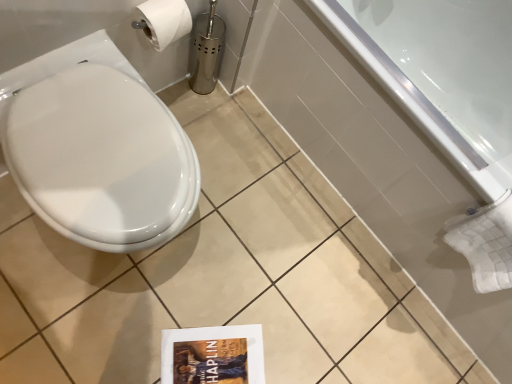
Describe the element at coordinates (375, 164) in the screenshot. I see `white glossy bathtub at upper right` at that location.

What is the approximate width of white glossy bathtub at upper right?

It is 27.56 inches.

The width and height of the screenshot is (512, 384). In order to click on white glossy bathtub at upper right in this screenshot , I will do `click(375, 164)`.

Where is `white glossy toilet at left`? The image size is (512, 384). white glossy toilet at left is located at coordinates (101, 159).

The height and width of the screenshot is (384, 512). Describe the element at coordinates (101, 159) in the screenshot. I see `white glossy toilet at left` at that location.

I want to click on white glossy bathtub at upper right, so click(x=375, y=164).

Which object is positioned more to the left, white glossy bathtub at upper right or white glossy toilet at left?

white glossy toilet at left.

Which is behind, white glossy bathtub at upper right or white glossy toilet at left?

white glossy bathtub at upper right is further away from the camera.

Considering the points (450, 174) and (150, 243), which point is behind, point (450, 174) or point (150, 243)?

The point (450, 174) is behind.

From the image's perspective, is white glossy bathtub at upper right above or below white glossy toilet at left?

Based on their image positions, white glossy bathtub at upper right is located above white glossy toilet at left.

From the picture: From a real-world perspective, between white glossy bathtub at upper right and white glossy toilet at left, who is vertically lower?

From a 3D spatial view, white glossy bathtub at upper right is below.

Between white glossy bathtub at upper right and white glossy toilet at left, which one has smaller width?

Thinner between the two is white glossy toilet at left.

Considering the relative sizes of white glossy bathtub at upper right and white glossy toilet at left in the image provided, is white glossy bathtub at upper right taller than white glossy toilet at left?

Correct, white glossy bathtub at upper right is much taller as white glossy toilet at left.

Who is smaller, white glossy bathtub at upper right or white glossy toilet at left?

white glossy toilet at left.

Choose the correct answer: Is white glossy bathtub at upper right inside white glossy toilet at left or outside it?

white glossy bathtub at upper right is located beyond the bounds of white glossy toilet at left.

Is white glossy bathtub at upper right touching white glossy toilet at left?

No, white glossy bathtub at upper right is not in contact with white glossy toilet at left.

Is white glossy bathtub at upper right oriented towards white glossy toilet at left?

Yes, white glossy bathtub at upper right is aimed at white glossy toilet at left.

What's the angular difference between white glossy bathtub at upper right and white glossy toilet at left's facing directions?

89.5 degrees.

You are a GUI agent. You are given a task and a screenshot of the screen. Output one action in this format:
    pyautogui.click(x=<x>, y=<y>)
    Task: Click on the toilet below the white glossy bathtub at upper right (from the image's perspective)
    Image resolution: width=512 pixels, height=384 pixels.
    Given the screenshot: What is the action you would take?
    pyautogui.click(x=101, y=159)

Is white glossy toilet at left at the left side of white glossy bathtub at upper right?

Yes, white glossy toilet at left is to the left of white glossy bathtub at upper right.

Considering the positions of objects white glossy toilet at left and white glossy bathtub at upper right in the image provided, who is behind, white glossy toilet at left or white glossy bathtub at upper right?

white glossy bathtub at upper right is further away from the camera.

Which is nearer, (148,113) or (431,238)?

Point (148,113) appears to be closer to the viewer than point (431,238).

From the image's perspective, is white glossy toilet at left beneath white glossy bathtub at upper right?

Yes.

From a real-world perspective, who is located lower, white glossy toilet at left or white glossy bathtub at upper right?

From a 3D spatial view, white glossy bathtub at upper right is below.

Can you confirm if white glossy toilet at left is wider than white glossy bathtub at upper right?

No, white glossy toilet at left is not wider than white glossy bathtub at upper right.

Between white glossy toilet at left and white glossy bathtub at upper right, which one has less height?

Standing shorter between the two is white glossy toilet at left.

Between white glossy toilet at left and white glossy bathtub at upper right, which one has smaller size?

white glossy toilet at left.

Is white glossy toilet at left inside or outside of white glossy bathtub at upper right?

white glossy toilet at left is spatially situated outside white glossy bathtub at upper right.

Is white glossy toilet at left placed right next to white glossy bathtub at upper right?

No, white glossy toilet at left is not touching white glossy bathtub at upper right.

Is white glossy toilet at left aimed at white glossy bathtub at upper right?

No, white glossy toilet at left does not turn towards white glossy bathtub at upper right.

Can you tell me how much white glossy toilet at left and white glossy bathtub at upper right differ in facing direction?

89.5 degrees separate the facing orientations of white glossy toilet at left and white glossy bathtub at upper right.

Where is `toilet lying in front of the white glossy bathtub at upper right`? This screenshot has width=512, height=384. toilet lying in front of the white glossy bathtub at upper right is located at coordinates (101, 159).

You are a GUI agent. You are given a task and a screenshot of the screen. Output one action in this format:
    pyautogui.click(x=<x>, y=<y>)
    Task: Click on the toilet above the white glossy bathtub at upper right (from a real-world perspective)
    The width and height of the screenshot is (512, 384).
    Given the screenshot: What is the action you would take?
    pyautogui.click(x=101, y=159)

At what (x,y) coordinates should I click in order to perform the action: click on toilet lying below the white glossy bathtub at upper right (from the image's perspective). Please return your answer as a coordinate pair (x, y). Looking at the image, I should click on (101, 159).